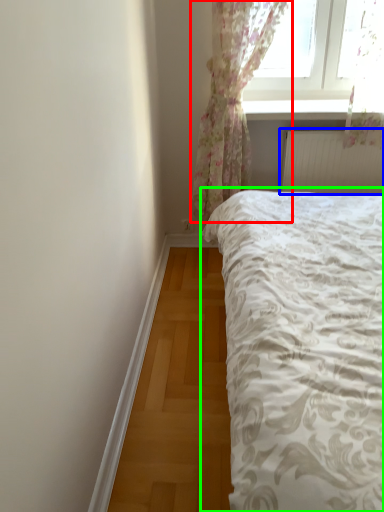
Question: Based on their relative distances, which object is farther from curtain (highlighted by a red box)? Choose from radiator (highlighted by a blue box) and bed (highlighted by a green box).

Choices:
 (A) radiator
 (B) bed

Answer: (B)